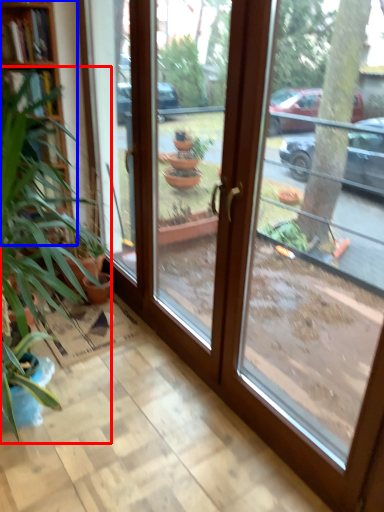
Question: Which of the following is the farthest to the observer, houseplant (highlighted by a red box) or bookshelf (highlighted by a blue box)?

Choices:
 (A) houseplant
 (B) bookshelf

Answer: (B)